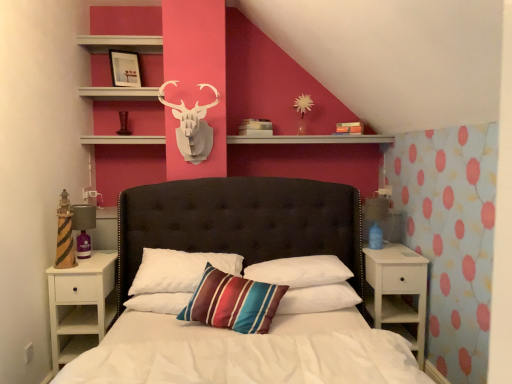
Locate an element on the screen. Image resolution: width=512 pixels, height=384 pixels. striped fabric pillow at center, marked as the 1th pillow in a left-to-right arrangement is located at coordinates (178, 270).

At what (x,y) coordinates should I click in order to perform the action: click on white soft pillow at center, acting as the first pillow starting from the right. Please return your answer as a coordinate pair (x, y). Looking at the image, I should click on (318, 299).

Locate an element on the screen. The width and height of the screenshot is (512, 384). white matte nightstand at right, which is the 1th nightstand from right to left is located at coordinates (398, 291).

Measure the distance between white matte nightstand at right, the second nightstand positioned from the left, and camera.

white matte nightstand at right, the second nightstand positioned from the left, and camera are 9.00 feet apart from each other.

Find the location of a particular element. This screenshot has width=512, height=384. matte black picture frame at upper center is located at coordinates (125, 69).

Where is `striped fabric pillow at center, positioned as the third pillow in right-to-left order`? striped fabric pillow at center, positioned as the third pillow in right-to-left order is located at coordinates (233, 302).

Are striped fabric pillow at center, marked as the 1th pillow in a left-to-right arrangement, and white wood nightstand at lower left, which is the 2th nightstand in right-to-left order, making contact?

No, striped fabric pillow at center, marked as the 1th pillow in a left-to-right arrangement, is not next to white wood nightstand at lower left, which is the 2th nightstand in right-to-left order.

Would you say striped fabric pillow at center, marked as the 1th pillow in a left-to-right arrangement, is inside or outside white wood nightstand at lower left, which is the 2th nightstand in right-to-left order?

striped fabric pillow at center, marked as the 1th pillow in a left-to-right arrangement, is located beyond the bounds of white wood nightstand at lower left, which is the 2th nightstand in right-to-left order.

Is point (142, 277) in front of point (90, 321)?

No, (142, 277) is further to viewer.

Which of these two, tufted leather bed at center or white matte shelf at upper center, is bigger?

Bigger between the two is tufted leather bed at center.

From a real-world perspective, relative to white matte shelf at upper center, is tufted leather bed at center vertically above or below?

In terms of real-world spatial position, tufted leather bed at center is below white matte shelf at upper center.

Is there a large distance between tufted leather bed at center and white matte shelf at upper center?

Actually, tufted leather bed at center and white matte shelf at upper center are a little close together.

Between tufted leather bed at center and matte black picture frame at upper center, which one is positioned in front?

tufted leather bed at center.

Which of these two, tufted leather bed at center or matte black picture frame at upper center, stands shorter?

With less height is matte black picture frame at upper center.

Can you confirm if tufted leather bed at center is wider than matte black picture frame at upper center?

Yes, tufted leather bed at center is wider than matte black picture frame at upper center.

Does point (345, 198) appear closer or farther from the camera than point (119, 70)?

Point (345, 198) is closer to the camera than point (119, 70).

Can you confirm if striped fabric pillow at center, marked as the 1th pillow in a left-to-right arrangement, is taller than white matte shelf at upper center?

Correct, striped fabric pillow at center, marked as the 1th pillow in a left-to-right arrangement, is much taller as white matte shelf at upper center.

From a real-world perspective, which is physically below, striped fabric pillow at center, marked as the 1th pillow in a left-to-right arrangement, or white matte shelf at upper center?

striped fabric pillow at center, marked as the 1th pillow in a left-to-right arrangement.

Does striped fabric pillow at center, marked as the 1th pillow in a left-to-right arrangement, have a greater width compared to white matte shelf at upper center?

Yes.

Is white wood nightstand at lower left, which is the 2th nightstand in right-to-left order, taller or shorter than matte black picture frame at upper center?

white wood nightstand at lower left, which is the 2th nightstand in right-to-left order, is taller than matte black picture frame at upper center.

From a real-world perspective, is white wood nightstand at lower left, which is the 2th nightstand in right-to-left order, positioned above or below matte black picture frame at upper center?

In terms of real-world spatial position, white wood nightstand at lower left, which is the 2th nightstand in right-to-left order, is below matte black picture frame at upper center.

Is white wood nightstand at lower left, the 1th nightstand when ordered from left to right, completely or partially outside of matte black picture frame at upper center?

Yes, white wood nightstand at lower left, the 1th nightstand when ordered from left to right, is outside of matte black picture frame at upper center.

Which point is more forward, (77,344) or (124,70)?

The point (77,344) is closer.

Which object is positioned more to the left, white wood nightstand at lower left, which is the 2th nightstand in right-to-left order, or white matte shelf at upper center?

From the viewer's perspective, white wood nightstand at lower left, which is the 2th nightstand in right-to-left order, appears more on the left side.

Which of these two, white wood nightstand at lower left, the 1th nightstand when ordered from left to right, or white matte shelf at upper center, is smaller?

With smaller size is white matte shelf at upper center.

Is white wood nightstand at lower left, which is the 2th nightstand in right-to-left order, thinner than white matte shelf at upper center?

Incorrect, the width of white wood nightstand at lower left, which is the 2th nightstand in right-to-left order, is not less than that of white matte shelf at upper center.

From the image's perspective, does white wood nightstand at lower left, which is the 2th nightstand in right-to-left order, appear higher than white matte shelf at upper center?

No.

Considering the relative sizes of striped fabric pillow at center, marked as the 1th pillow in a left-to-right arrangement, and matte black picture frame at upper center in the image provided, is striped fabric pillow at center, marked as the 1th pillow in a left-to-right arrangement, thinner than matte black picture frame at upper center?

In fact, striped fabric pillow at center, marked as the 1th pillow in a left-to-right arrangement, might be wider than matte black picture frame at upper center.

Could you tell me if striped fabric pillow at center, marked as the 1th pillow in a left-to-right arrangement, is turned towards matte black picture frame at upper center?

No, striped fabric pillow at center, marked as the 1th pillow in a left-to-right arrangement, is not aimed at matte black picture frame at upper center.

Is striped fabric pillow at center, the fourth pillow from the right, behind matte black picture frame at upper center?

No, striped fabric pillow at center, the fourth pillow from the right, is closer to the viewer.

Considering the positions of objects striped fabric pillow at center, marked as the 1th pillow in a left-to-right arrangement, and matte black picture frame at upper center in the image provided, who is more to the left, striped fabric pillow at center, marked as the 1th pillow in a left-to-right arrangement, or matte black picture frame at upper center?

From the viewer's perspective, matte black picture frame at upper center appears more on the left side.

Locate an element on the screen. This screenshot has width=512, height=384. nightstand on the left of striped fabric pillow at center, marked as the 1th pillow in a left-to-right arrangement is located at coordinates (81, 305).

Find the location of a particular element. mantle that appears above the tufted leather bed at center (from the image's perspective) is located at coordinates point(311,139).

Estimate the real-world distances between objects in this image. Which object is further from white wood nightstand at lower left, the 1th nightstand when ordered from left to right, white matte shelf at upper center or striped fabric pillow at center, the 2th pillow positioned from the left?

Based on the image, white matte shelf at upper center appears to be further to white wood nightstand at lower left, the 1th nightstand when ordered from left to right.

Looking at the image, which one is located further to white wood nightstand at lower left, which is the 2th nightstand in right-to-left order, striped fabric pillow at center, the fourth pillow from the right, or white matte nightstand at right, the second nightstand positioned from the left?

white matte nightstand at right, the second nightstand positioned from the left.

Which object lies nearer to the anchor point white wood nightstand at lower left, the 1th nightstand when ordered from left to right, white matte shelf at upper center or striped fabric pillow at center, marked as the 1th pillow in a left-to-right arrangement?

striped fabric pillow at center, marked as the 1th pillow in a left-to-right arrangement, lies closer to white wood nightstand at lower left, the 1th nightstand when ordered from left to right, than the other object.

Looking at the image, which one is located closer to white matte nightstand at right, the second nightstand positioned from the left, striped fabric pillow at center, positioned as the third pillow in right-to-left order, or white wood nightstand at lower left, the 1th nightstand when ordered from left to right?

striped fabric pillow at center, positioned as the third pillow in right-to-left order, is positioned closer to the anchor white matte nightstand at right, the second nightstand positioned from the left.

Based on the photo, looking at the image, which one is located further to white matte nightstand at right, which is the 1th nightstand from right to left, striped fabric pillow at center, positioned as the third pillow in right-to-left order, or matte black picture frame at upper center?

Based on the image, matte black picture frame at upper center appears to be further to white matte nightstand at right, which is the 1th nightstand from right to left.

Estimate the real-world distances between objects in this image. Which object is closer to matte black picture frame at upper center, striped fabric pillow at center, the 2th pillow positioned from the left, or white matte nightstand at right, which is the 1th nightstand from right to left?

striped fabric pillow at center, the 2th pillow positioned from the left.

When comparing their distances from white matte nightstand at right, the second nightstand positioned from the left, does striped fabric pillow at center, positioned as the third pillow in right-to-left order, or white matte shelf at upper center seem closer?

striped fabric pillow at center, positioned as the third pillow in right-to-left order.

From the image, which object appears to be farther from white soft pillow at center, which is the second pillow from right to left, matte black picture frame at upper center or striped fabric pillow at center, the fourth pillow from the right?

matte black picture frame at upper center.

Where is `bed situated between white wood nightstand at lower left, which is the 2th nightstand in right-to-left order, and white matte nightstand at right, which is the 1th nightstand from right to left, from left to right`? bed situated between white wood nightstand at lower left, which is the 2th nightstand in right-to-left order, and white matte nightstand at right, which is the 1th nightstand from right to left, from left to right is located at coordinates (240, 222).

Locate an element on the screen. pillow located between striped fabric pillow at center, positioned as the third pillow in right-to-left order, and white soft pillow at center, placed as the fourth pillow when sorted from left to right, in the left-right direction is located at coordinates 300,271.

Identify the location of pillow between tufted leather bed at center and white wood nightstand at lower left, which is the 2th nightstand in right-to-left order, from front to back. (233, 302).

The width and height of the screenshot is (512, 384). I want to click on mantle situated between white wood nightstand at lower left, the 1th nightstand when ordered from left to right, and white matte nightstand at right, which is the 1th nightstand from right to left, from left to right, so click(311, 139).